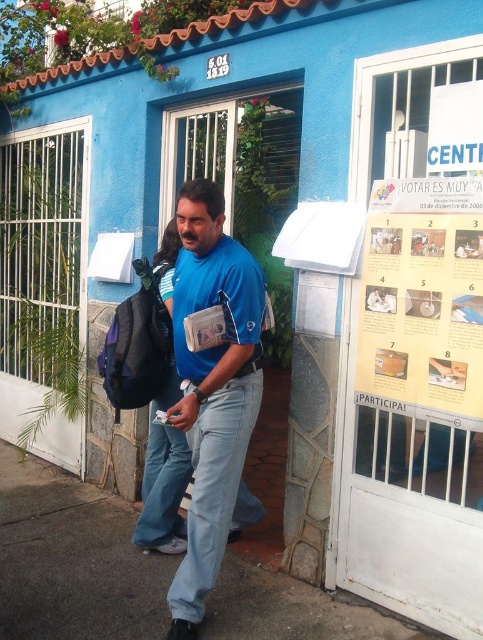
Who is taller, yellow paper poster at upper right or blue cotton shirt at center?

blue cotton shirt at center

Does yellow paper poster at upper right come in front of blue cotton shirt at center?

Yes, yellow paper poster at upper right is closer to the viewer.

Is point (410, 356) closer to viewer compared to point (257, 301)?

No, (410, 356) is behind (257, 301).

Locate an element on the screen. Image resolution: width=483 pixels, height=640 pixels. yellow paper poster at upper right is located at coordinates (423, 300).

Which is more to the right, gray concrete pavement at lower center or blue cotton shirt at center?

Positioned to the right is blue cotton shirt at center.

Between point (52, 538) and point (199, 182), which one is positioned in front?

Point (199, 182) is more forward.

Locate an element on the screen. This screenshot has height=640, width=483. gray concrete pavement at lower center is located at coordinates (71, 560).

Between gray concrete pavement at lower center and yellow paper poster at upper right, which one appears on the right side from the viewer's perspective?

yellow paper poster at upper right is more to the right.

Which is above, gray concrete pavement at lower center or yellow paper poster at upper right?

yellow paper poster at upper right is above.

The height and width of the screenshot is (640, 483). I want to click on gray concrete pavement at lower center, so click(71, 560).

This screenshot has height=640, width=483. What are the coordinates of `gray concrete pavement at lower center` in the screenshot? It's located at (71, 560).